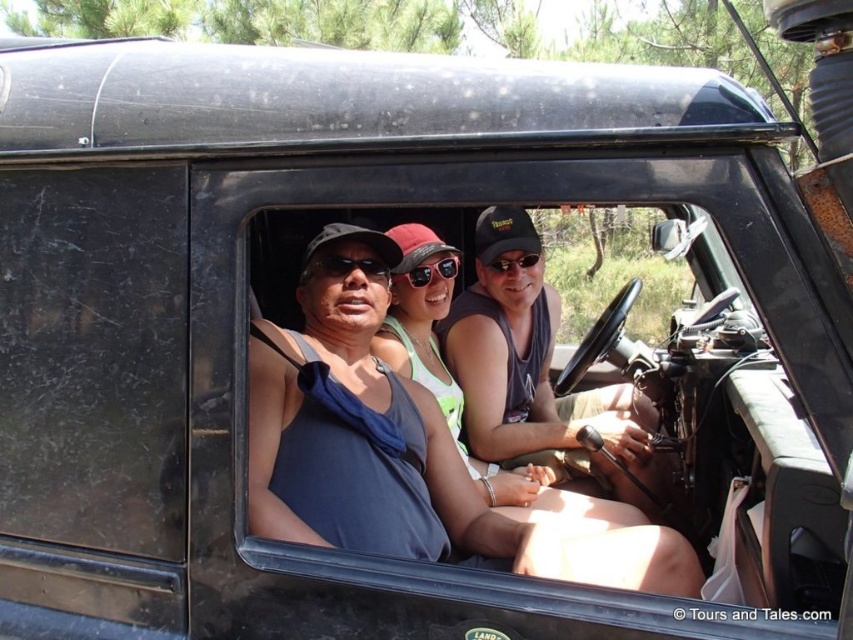
You are a photographer trying to capture a clear shot of the matte gray tank top at center and the black plastic sunglasses at center. Based on their positions, which object is closer to the camera?

The matte gray tank top at center is in front of the black plastic sunglasses at center, so it is closer to the camera.

You are a photographer trying to capture the matte gray tank top at center and the black plastic sunglasses at center in the same frame. Based on their sizes, which object would you need to focus on more carefully to ensure it fits entirely within the camera frame?

The matte gray tank top at center might be wider than black plastic sunglasses at center, so you should focus on ensuring the matte gray tank top at center fits entirely within the frame first.